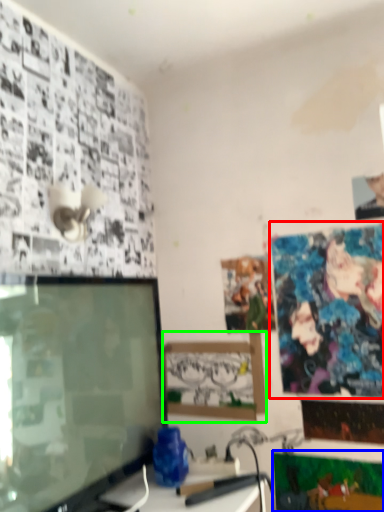
Question: Which is farther away from poster page (highlighted by a red box)? poster page (highlighted by a blue box) or picture frame (highlighted by a green box)?

Choices:
 (A) poster page
 (B) picture frame

Answer: (A)